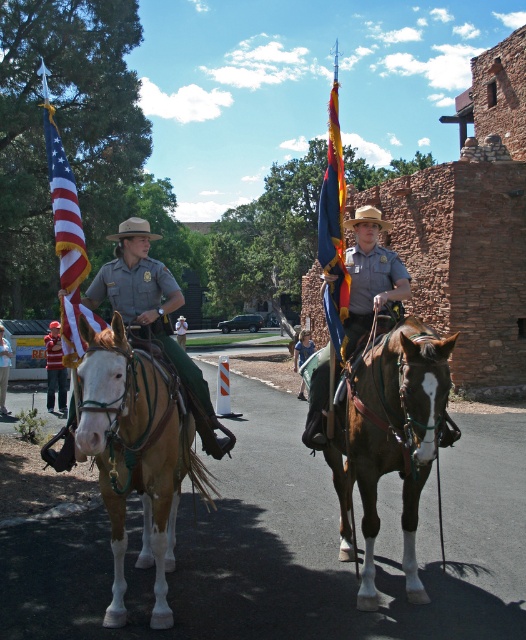
You are a photographer positioned at the back of the scene. You want to capture both the american flag at left and the tan woven cowboy hat at center in your shot. Which object should you focus on first to ensure it appears larger in the photo?

The american flag at left is much taller than the tan woven cowboy hat at center, so you should focus on the american flag at left first to ensure it appears larger in the photo.